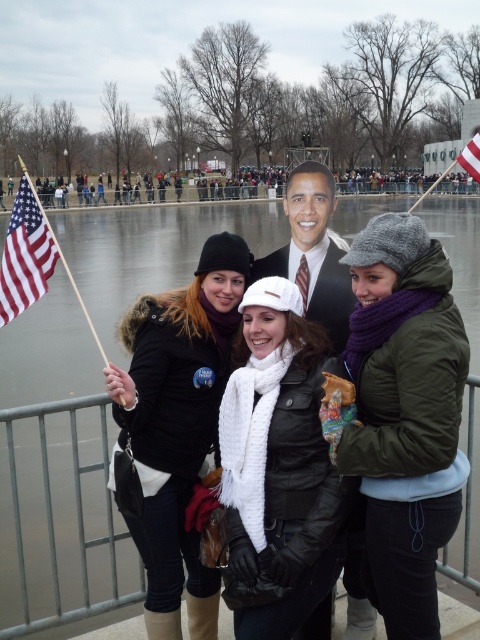
Can you confirm if matte black jacket at center is positioned above american flag at upper right?

Incorrect, matte black jacket at center is not positioned above american flag at upper right.

Which is in front, point (180, 422) or point (478, 182)?

Positioned in front is point (180, 422).

Locate an element on the screen. matte black jacket at center is located at coordinates click(178, 424).

Can you confirm if metal fence at lower center is positioned below smooth plastic obama head at center?

Yes.

What do you see at coordinates (59, 518) in the screenshot? I see `metal fence at lower center` at bounding box center [59, 518].

Where is `metal fence at lower center`? Image resolution: width=480 pixels, height=640 pixels. metal fence at lower center is located at coordinates (59, 518).

Is white knitted hat at center below matte black jacket at center?

Correct, white knitted hat at center is located below matte black jacket at center.

Does point (283, 332) lie in front of point (203, 625)?

Yes, it is in front of point (203, 625).

Does point (231, 468) come farther from viewer compared to point (189, 314)?

No.

You are a GUI agent. You are given a task and a screenshot of the screen. Output one action in this format:
    pyautogui.click(x=<x>, y=<y>)
    Task: Click on the white knitted hat at center
    
    Given the screenshot: What is the action you would take?
    pyautogui.click(x=278, y=465)